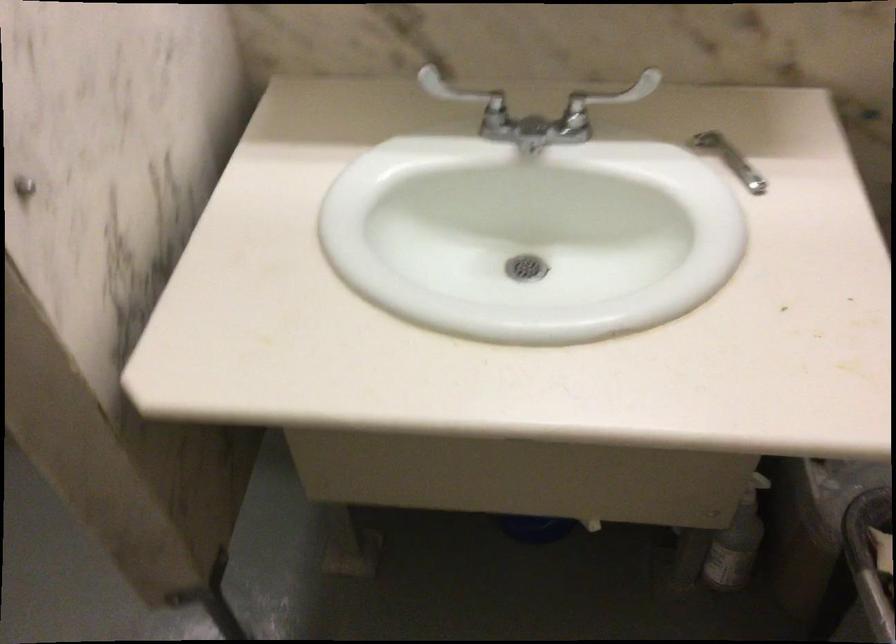
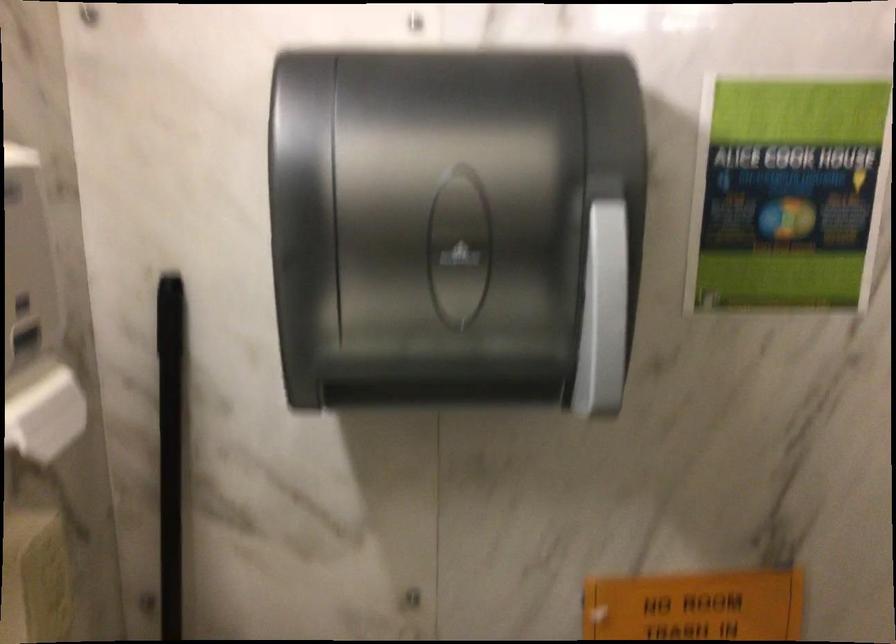
Question: The camera is either moving clockwise (left) or counter-clockwise (right) around the object. The first image is from the beginning of the video and the second image is from the end. Is the camera moving left or right when shooting the video?

Choices:
 (A) Left
 (B) Right

Answer: (A)